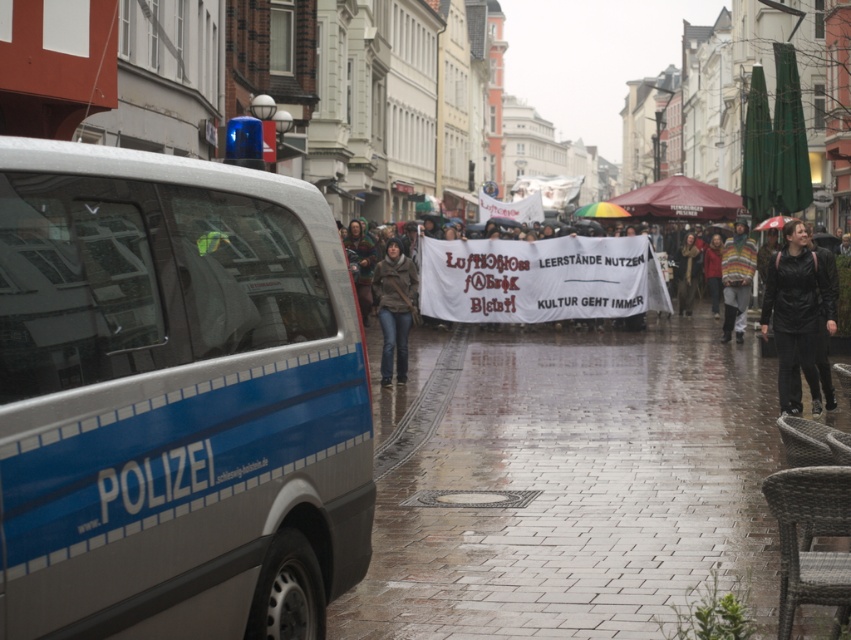
Looking at this image, you are a photographer trying to capture a candid shot of both the brown leather jacket at center and the striped sweater at center in the protest scene. Since you want to ensure both are clearly visible in the frame, which clothing item should you focus on first to avoid blurring due to their size differences?

The brown leather jacket at center is smaller in size compared to the striped sweater at center. To ensure both are clearly visible, focus on the striped sweater at center first as it is larger and might require less adjustment in the camera settings for clarity.

You are a protester holding a sign and need to reach the white fabric banner at center to join your group. The police van is blocking your path. Can you walk around the van to reach the banner? Please explain your reasoning based on their positions.

The white fabric banner at center is located at point (530,280). Since the police van is in the foreground, it is likely positioned closer to the viewer than the banner. This means the banner is behind the van, so you would need to go around the van to reach it. However, without knowing the exact dimensions and layout of the street, it is uncertain if there is enough space to maneuver around the van safely.

You are a photographer trying to capture a clear shot of the protest scene. You notice the white fabric banner at center and the brown leather jacket at center in your frame. Which object should you adjust your camera angle to prioritize if you want to focus on the larger subject?

The brown leather jacket at center should be prioritized since it occupies more space than the white fabric banner at center according to the description.